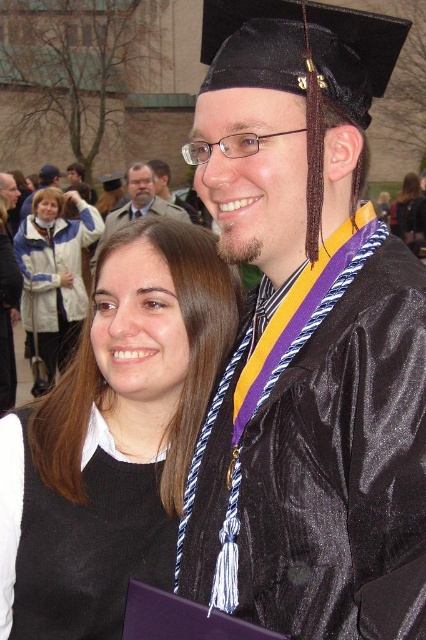
How much distance is there between shiny black graduation gown at center and white fleece jacket at upper left?

A distance of 20.20 meters exists between shiny black graduation gown at center and white fleece jacket at upper left.

Can you confirm if shiny black graduation gown at center is shorter than white fleece jacket at upper left?

Indeed, shiny black graduation gown at center has a lesser height compared to white fleece jacket at upper left.

Is point (400, 460) closer to camera compared to point (17, 241)?

Yes, it is.

Image resolution: width=426 pixels, height=640 pixels. I want to click on shiny black graduation gown at center, so click(x=307, y=336).

Who is higher up, white fleece jacket at upper left or matte black graduation gown at center?

matte black graduation gown at center is higher up.

Describe the element at coordinates (54, 276) in the screenshot. I see `white fleece jacket at upper left` at that location.

Is point (34, 392) behind point (112, 221)?

No, (34, 392) is closer to viewer.

Find the location of a particular element. The width and height of the screenshot is (426, 640). white fleece jacket at upper left is located at coordinates 54,276.

Which is more to the right, shiny black graduation gown at center or matte black dress at center?

matte black dress at center

In the scene shown: Can you confirm if shiny black graduation gown at center is taller than matte black dress at center?

No.

Which is in front, point (324, 83) or point (405, 198)?

Point (324, 83)

In order to click on shiny black graduation gown at center in this screenshot , I will do `click(307, 336)`.